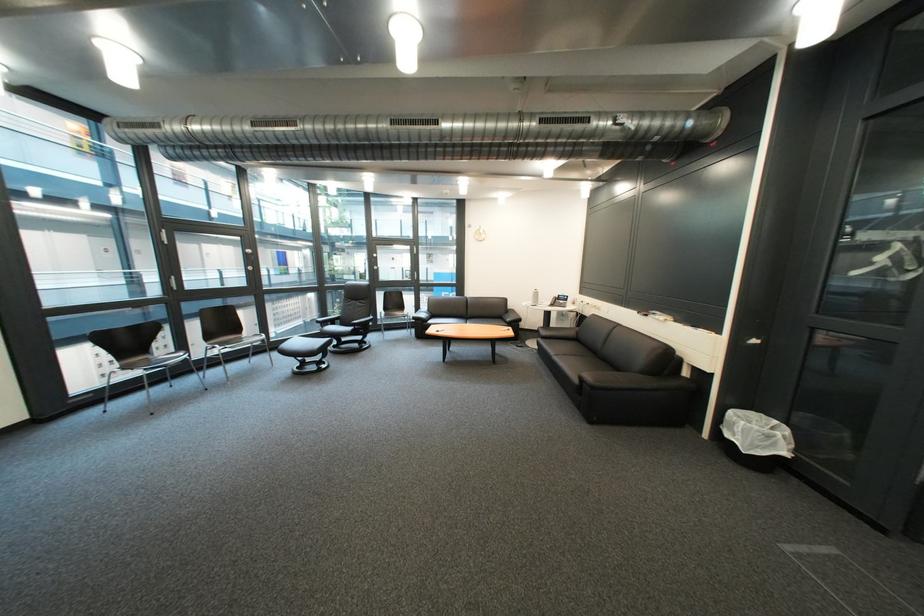
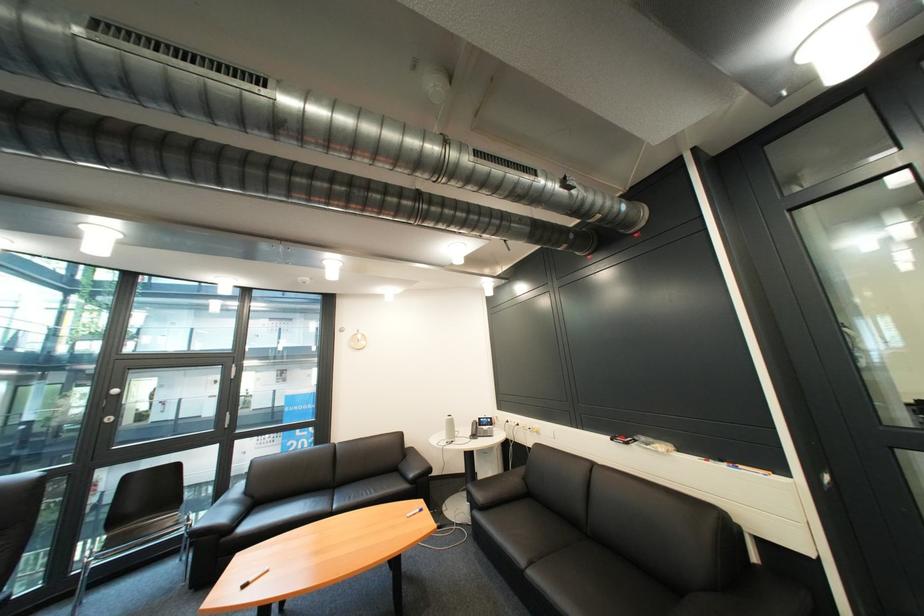
Locate, in the second image, the point that corresponds to point 703,330 in the first image.

(736, 468)